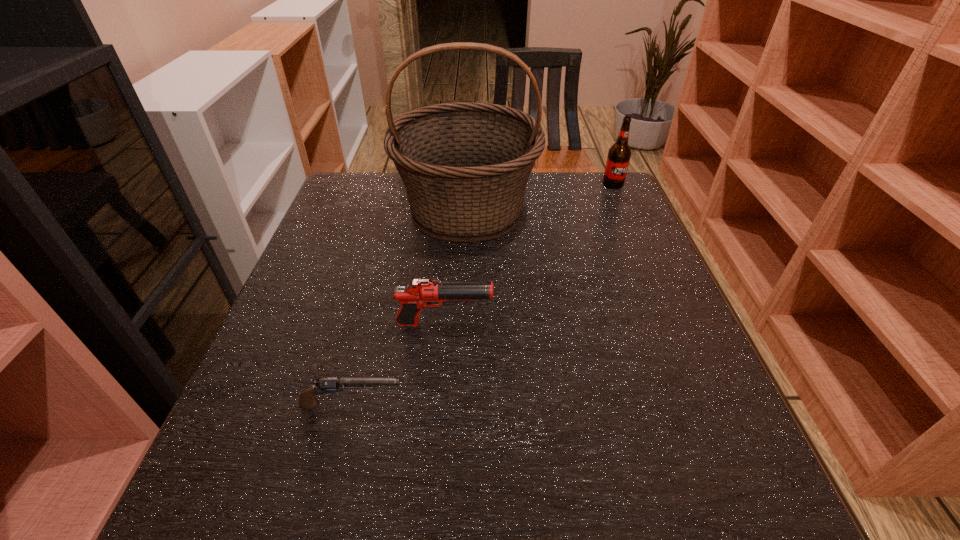
Locate an element on the screen. vacant space situated aiming along the barrel of the shortest object is located at coordinates (617, 405).

I want to click on basket that is at the far edge, so click(x=465, y=166).

This screenshot has width=960, height=540. Identify the location of root beer situated at the far edge. (618, 159).

Find the location of a particular element. The height and width of the screenshot is (540, 960). object located in the left edge section of the desktop is located at coordinates (307, 400).

Image resolution: width=960 pixels, height=540 pixels. I want to click on object at the right edge, so point(618,159).

Find the location of a particular element. object located at the far right corner is located at coordinates (618, 159).

In the image, there is a desktop. Where is `blank space at the near edge`? The image size is (960, 540). blank space at the near edge is located at coordinates (637, 470).

The height and width of the screenshot is (540, 960). I want to click on vacant region at the left edge of the desktop, so click(x=370, y=219).

Find the location of a particular element. The height and width of the screenshot is (540, 960). vacant space at the right edge of the desktop is located at coordinates (582, 242).

In the image, there is a desktop. Where is `vacant space at the far left corner`? vacant space at the far left corner is located at coordinates (348, 176).